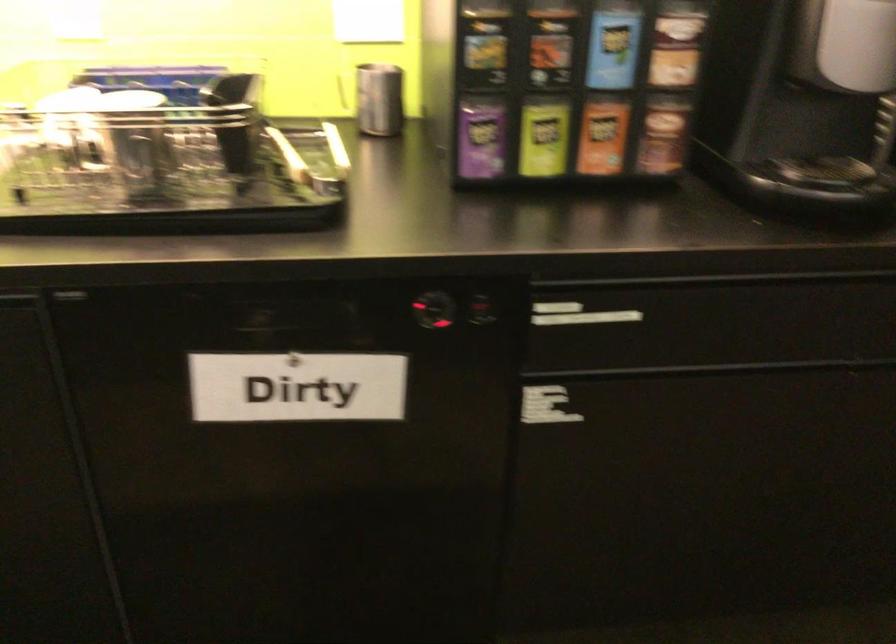
Locate an element on the screen. dishwasher control dial is located at coordinates (433, 310).